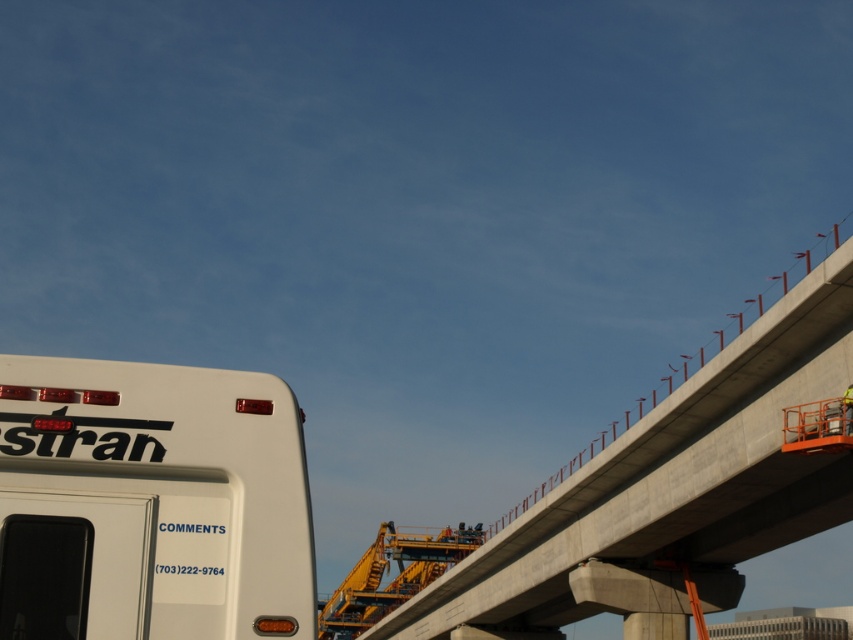
Question: Which point is farther to the camera?

Choices:
 (A) (13, 486)
 (B) (804, 536)

Answer: (B)

Question: Is white matte bus at lower left closer to the viewer compared to concrete at upper right?

Choices:
 (A) no
 (B) yes

Answer: (B)

Question: Which of the following is the closest to the observer?

Choices:
 (A) concrete at upper right
 (B) white matte bus at lower left

Answer: (B)

Question: Is white matte bus at lower left wider than concrete at upper right?

Choices:
 (A) yes
 (B) no

Answer: (B)

Question: Is white matte bus at lower left to the right of concrete at upper right from the viewer's perspective?

Choices:
 (A) no
 (B) yes

Answer: (A)